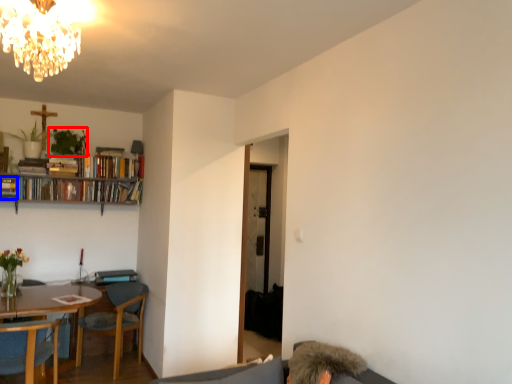
Question: Which object appears farthest to the camera in this image, plant (highlighted by a red box) or book (highlighted by a blue box)?

Choices:
 (A) plant
 (B) book

Answer: (A)